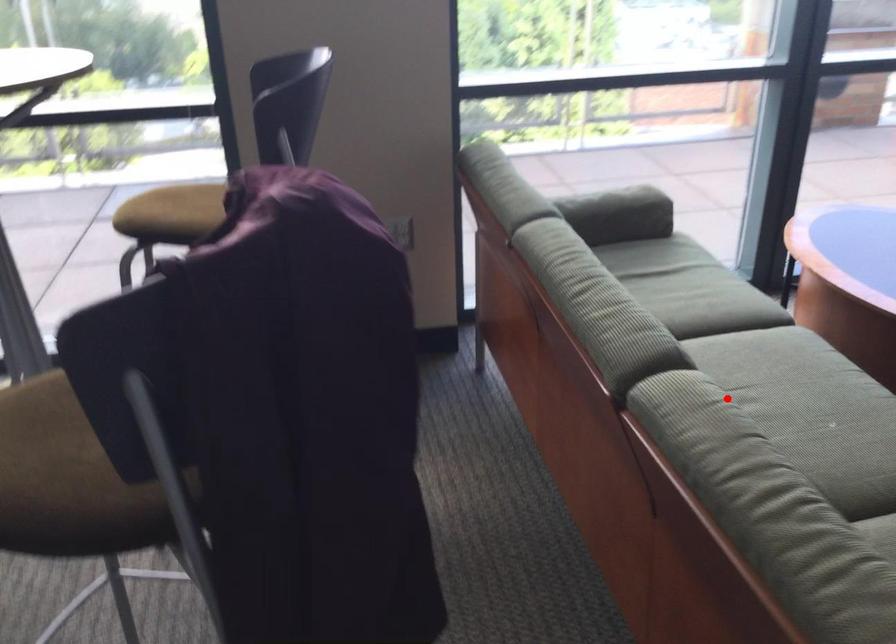
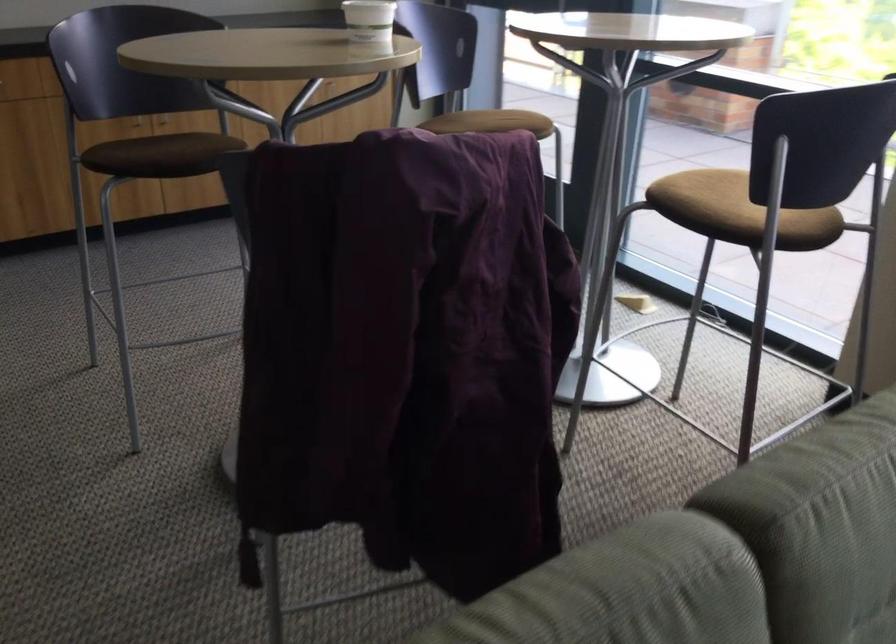
Question: A red point is marked in image1. In image2, is the corresponding 3D point closer to the camera or farther? Reply with the corresponding letter.

Choices:
 (A) The corresponding 3D point is closer.
 (B) The corresponding 3D point is farther.

Answer: (A)